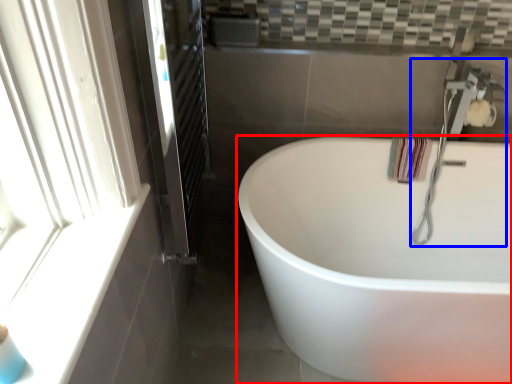
Question: Which of the following is the closest to the observer, bathtub (highlighted by a red box) or faucet (highlighted by a blue box)?

Choices:
 (A) bathtub
 (B) faucet

Answer: (A)